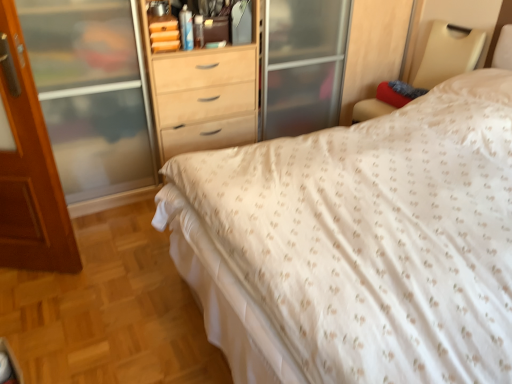
The width and height of the screenshot is (512, 384). Identify the location of empty space that is to the right of brown wooden door at left. (104, 268).